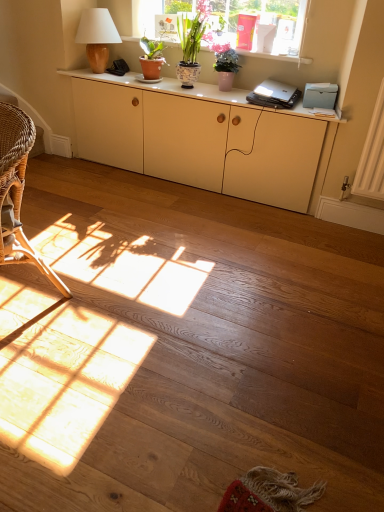
Question: From the image's perspective, is pink ceramic vase at upper center, which is the first houseplant from right to left, on textured ceramic pot at upper center, the 2th houseplant in the left-to-right sequence?

Choices:
 (A) no
 (B) yes

Answer: (A)

Question: Is pink ceramic vase at upper center, the third houseplant in the left-to-right sequence, next to textured ceramic pot at upper center, acting as the second houseplant starting from the right?

Choices:
 (A) yes
 (B) no

Answer: (B)

Question: Can you confirm if pink ceramic vase at upper center, the third houseplant in the left-to-right sequence, is wider than textured ceramic pot at upper center, acting as the second houseplant starting from the right?

Choices:
 (A) yes
 (B) no

Answer: (B)

Question: Does pink ceramic vase at upper center, which is the first houseplant from right to left, have a lesser width compared to textured ceramic pot at upper center, the 2th houseplant in the left-to-right sequence?

Choices:
 (A) yes
 (B) no

Answer: (A)

Question: Is pink ceramic vase at upper center, the third houseplant in the left-to-right sequence, bigger than textured ceramic pot at upper center, the 2th houseplant in the left-to-right sequence?

Choices:
 (A) yes
 (B) no

Answer: (B)

Question: From the image's perspective, is pink ceramic vase at upper center, which is the first houseplant from right to left, beneath textured ceramic pot at upper center, acting as the second houseplant starting from the right?

Choices:
 (A) yes
 (B) no

Answer: (A)

Question: Does matte wood lamp at upper left appear on the right side of woven rattan chair at left?

Choices:
 (A) yes
 (B) no

Answer: (A)

Question: Considering the relative sizes of matte wood lamp at upper left and woven rattan chair at left in the image provided, is matte wood lamp at upper left taller than woven rattan chair at left?

Choices:
 (A) no
 (B) yes

Answer: (A)

Question: From a real-world perspective, does matte wood lamp at upper left stand above woven rattan chair at left?

Choices:
 (A) no
 (B) yes

Answer: (B)

Question: From the image's perspective, would you say matte wood lamp at upper left is shown under woven rattan chair at left?

Choices:
 (A) yes
 (B) no

Answer: (B)

Question: Would you say matte wood lamp at upper left is outside woven rattan chair at left?

Choices:
 (A) no
 (B) yes

Answer: (B)

Question: From a real-world perspective, is matte wood lamp at upper left below woven rattan chair at left?

Choices:
 (A) yes
 (B) no

Answer: (B)

Question: From a real-world perspective, is matte terracotta pot at upper center, the first houseplant viewed from the left, over matte cream cabinet at center?

Choices:
 (A) no
 (B) yes

Answer: (B)